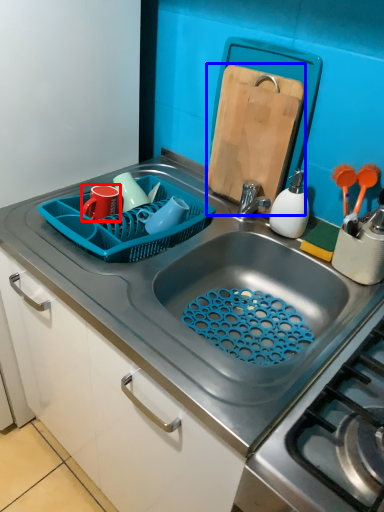
Question: Which object appears farthest to the camera in this image, tableware (highlighted by a red box) or cutting board (highlighted by a blue box)?

Choices:
 (A) tableware
 (B) cutting board

Answer: (A)